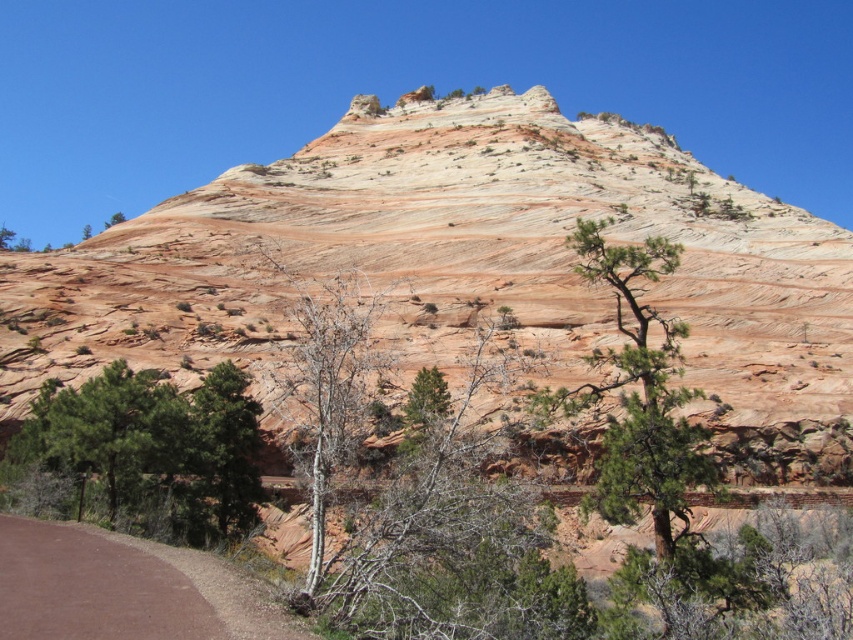
You are a hiker who wants to take a photo of both the bare wood tree at center and the green leafy tree at lower left. Since you want both trees to be fully visible in the frame, which tree should you stand closer to and why?

You should stand closer to the bare wood tree at center because it is shorter than the green leafy tree at lower left. By positioning yourself nearer to the shorter tree, you can ensure both trees are fully visible within the camera frame without one being cut off.

You are a hiker carrying a 20 meter long rope. You want to tie the rope between the brown dirt path at lower left and the bare wood tree at center. Can you do this without the rope being too short?

The distance between the brown dirt path at lower left and the bare wood tree at center is 19.54 meters, so the 20 meter rope is long enough to tie between them without being too short.

You are a hiker standing at the base of the cliff and want to take a photo of both the bare wood tree at center and the green leafy tree at lower left. Which tree should you position yourself to the left of to include both in your frame?

You should position yourself to the left of the green leafy tree at lower left because the bare wood tree at center is on the right side of it, allowing both trees to be captured in the frame.